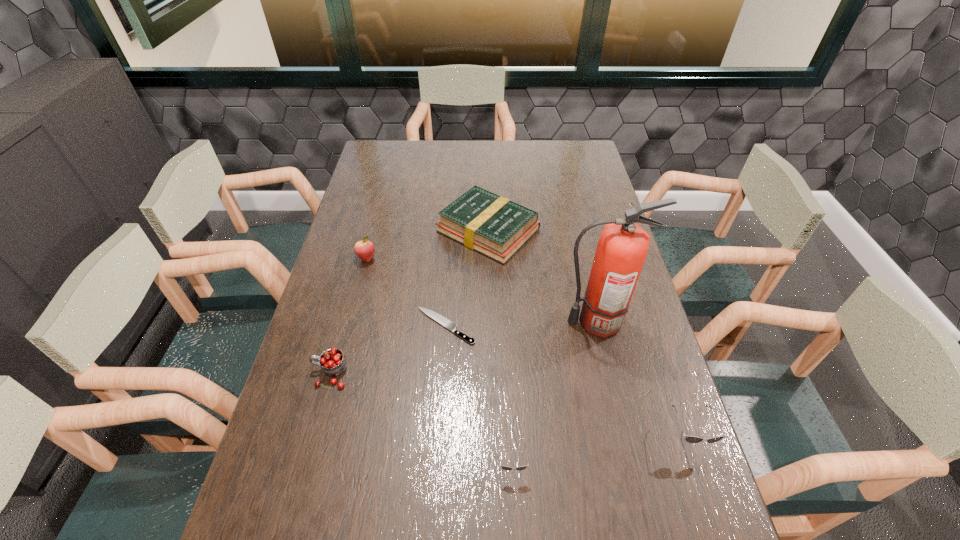
In order to click on fire extinguisher that is positioned at the right edge in this screenshot , I will do `click(622, 248)`.

The height and width of the screenshot is (540, 960). In the image, there is a desktop. In order to click on vacant space at the far edge in this screenshot , I will do `click(469, 152)`.

In the image, there is a desktop. Where is `vacant space at the near edge`? The image size is (960, 540). vacant space at the near edge is located at coordinates (480, 483).

I want to click on free region at the left edge, so click(x=366, y=330).

The image size is (960, 540). In the image, there is a desktop. Find the location of `vacant space at the right edge`. vacant space at the right edge is located at coordinates (564, 177).

The height and width of the screenshot is (540, 960). I want to click on vacant region at the far left corner of the desktop, so click(x=404, y=162).

What are the coordinates of `vacant space at the far right corner` in the screenshot? It's located at (564, 152).

This screenshot has height=540, width=960. I want to click on vacant space in between the fire extinguisher and the taller sunglasses, so click(x=641, y=379).

The width and height of the screenshot is (960, 540). I want to click on empty space that is in between the taller sunglasses and the shortest object, so click(566, 381).

Locate an element on the screen. This screenshot has width=960, height=540. empty space between the apple and the third nearest object is located at coordinates coord(348,316).